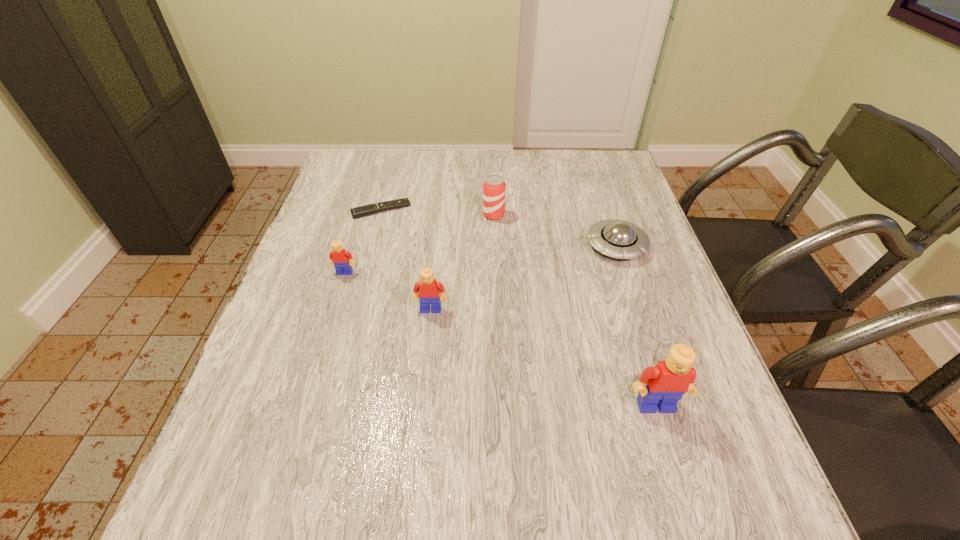
Find the location of a particular element. This screenshot has width=960, height=540. free point between the fourth object from right to left and the farthest Lego is located at coordinates (388, 291).

Find the location of a particular element. Image resolution: width=960 pixels, height=540 pixels. free space between the nearest Lego and the fourth nearest object is located at coordinates tap(636, 326).

The width and height of the screenshot is (960, 540). I want to click on free space between the tallest Lego and the shortest object, so click(518, 308).

Locate an element on the screen. free spot between the beer can and the tallest Lego is located at coordinates (575, 310).

The height and width of the screenshot is (540, 960). Identify the location of free area in between the fourth object from left to right and the shortest Lego. coord(420,244).

In order to click on empty location between the fifth farthest object and the leftmost Lego in this screenshot , I will do `click(388, 291)`.

Locate an element on the screen. The image size is (960, 540). object identified as the closest to the leftmost Lego is located at coordinates (427, 291).

Locate an element on the screen. object identified as the second closest to the shortest object is located at coordinates (494, 188).

The height and width of the screenshot is (540, 960). Identify the location of Lego that is the second closest to the third nearest object. (661, 387).

The width and height of the screenshot is (960, 540). I want to click on Lego that is the closest to the shortest object, so click(339, 256).